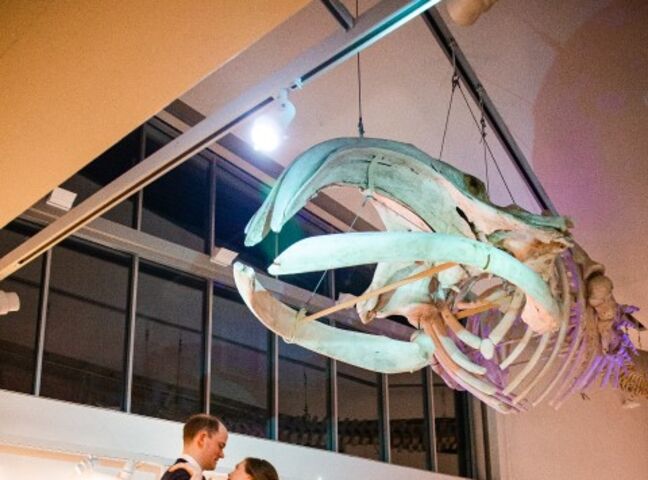
This screenshot has height=480, width=648. Identify the location of cables. (359, 107), (361, 204), (440, 137), (475, 115), (483, 167).